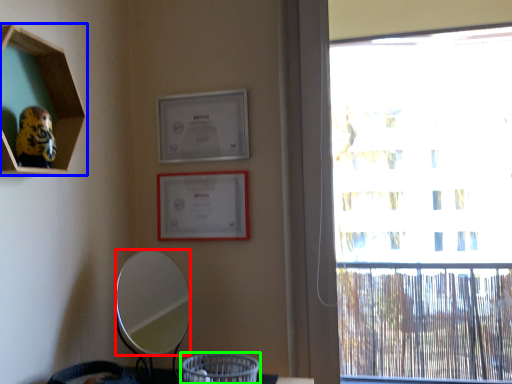
Question: Considering the real-world distances, which object is closest to mirror (highlighted by a red box)? shelf (highlighted by a blue box) or basket (highlighted by a green box).

Choices:
 (A) shelf
 (B) basket

Answer: (B)